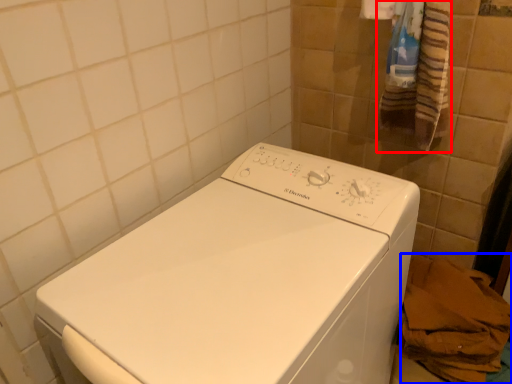
Question: Which point is closer to the camera, bath towel (highlighted by a red box) or material (highlighted by a blue box)?

Choices:
 (A) bath towel
 (B) material

Answer: (A)